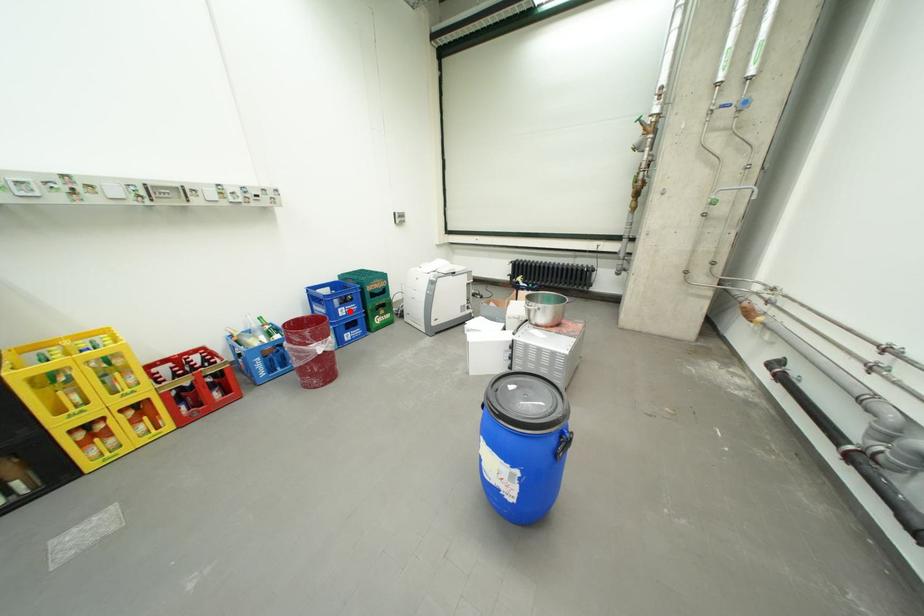
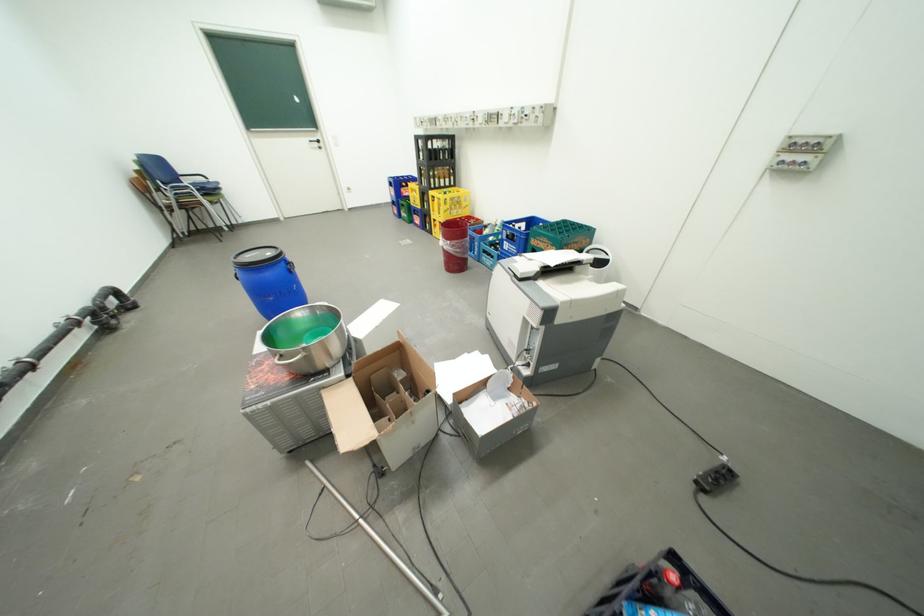
Question: I am providing you with two images of the same scene from different viewpoints. A red point is marked on the first image. At the location where the point appears in image 1, is it still visible in image 2?

Choices:
 (A) Yes
 (B) No

Answer: (A)